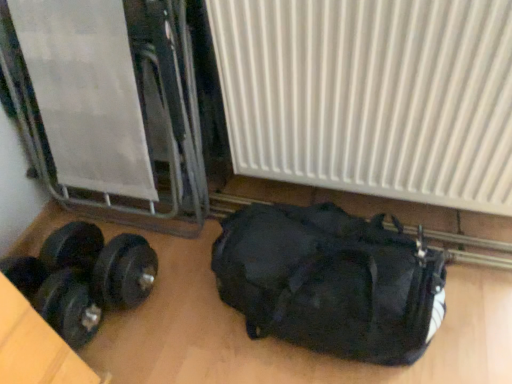
Question: Is black matte duffel bag at lower right looking in the opposite direction of black rubber dumbbell at lower left?

Choices:
 (A) yes
 (B) no

Answer: (A)

Question: Considering the relative positions of black matte duffel bag at lower right and black rubber dumbbell at lower left in the image provided, is black matte duffel bag at lower right to the right of black rubber dumbbell at lower left from the viewer's perspective?

Choices:
 (A) yes
 (B) no

Answer: (A)

Question: Can you confirm if black matte duffel bag at lower right is shorter than black rubber dumbbell at lower left?

Choices:
 (A) no
 (B) yes

Answer: (A)

Question: Are black matte duffel bag at lower right and black rubber dumbbell at lower left beside each other?

Choices:
 (A) yes
 (B) no

Answer: (B)

Question: Is black rubber dumbbell at lower left inside black matte duffel bag at lower right?

Choices:
 (A) no
 (B) yes

Answer: (A)

Question: Is black matte duffel bag at lower right positioned far away from black rubber dumbbell at lower left?

Choices:
 (A) no
 (B) yes

Answer: (A)

Question: Is black matte duffel bag at lower right facing towards white ribbed radiator at center?

Choices:
 (A) no
 (B) yes

Answer: (A)

Question: From the image's perspective, is black matte duffel bag at lower right over white ribbed radiator at center?

Choices:
 (A) no
 (B) yes

Answer: (A)

Question: Considering the relative sizes of black matte duffel bag at lower right and white ribbed radiator at center in the image provided, is black matte duffel bag at lower right thinner than white ribbed radiator at center?

Choices:
 (A) yes
 (B) no

Answer: (B)

Question: From a real-world perspective, is black matte duffel bag at lower right physically above white ribbed radiator at center?

Choices:
 (A) no
 (B) yes

Answer: (A)

Question: Is black matte duffel bag at lower right wider than white ribbed radiator at center?

Choices:
 (A) no
 (B) yes

Answer: (B)

Question: Is black matte duffel bag at lower right facing away from white ribbed radiator at center?

Choices:
 (A) no
 (B) yes

Answer: (A)

Question: Can you confirm if white ribbed radiator at center is wider than black rubber dumbbell at lower left?

Choices:
 (A) no
 (B) yes

Answer: (A)